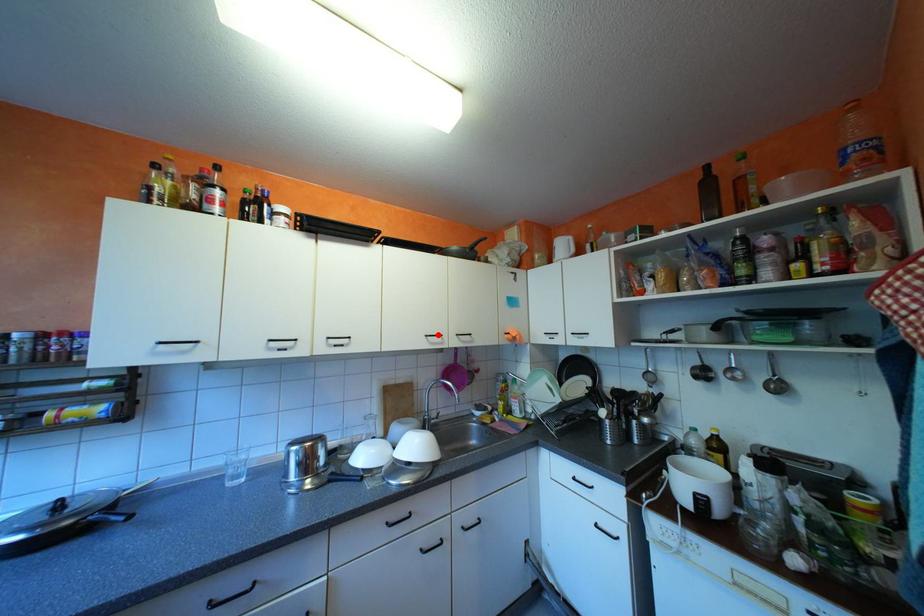
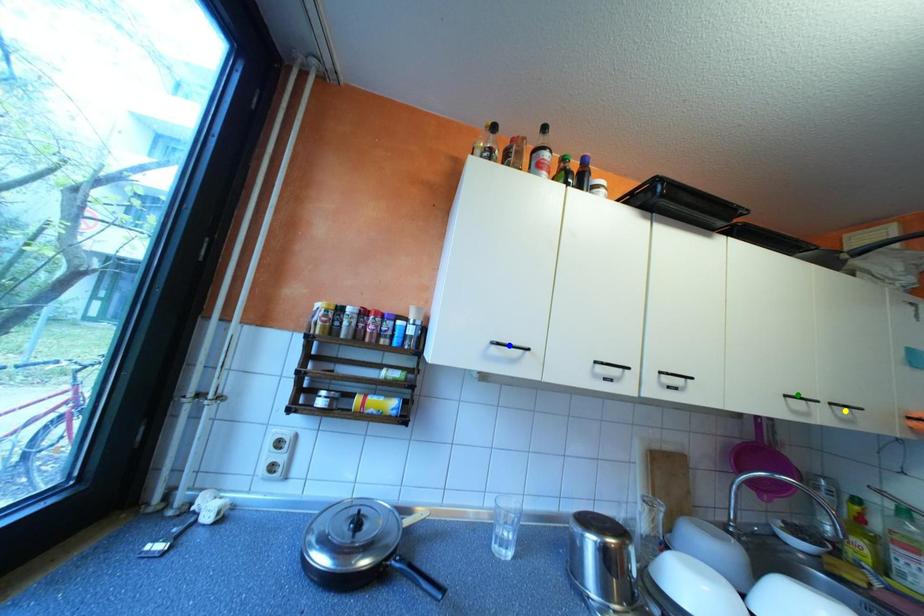
Question: I am providing you with two images of the same scene from different viewpoints. A red point is marked on the first image. You are given multiple points on the second image. Which point in image 2 represents the same 3d spot as the red point in image 1?

Choices:
 (A) blue point
 (B) yellow point
 (C) green point

Answer: (C)